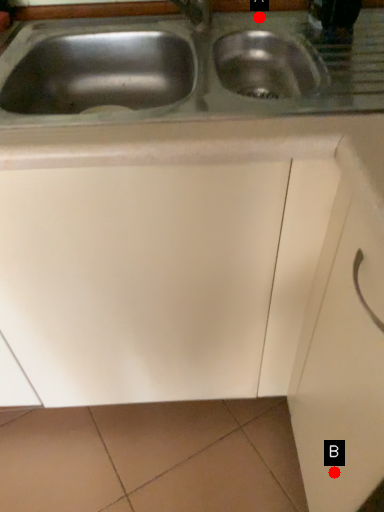
Question: Two points are circled on the image, labeled by A and B beside each circle. Which point is closer to the camera?

Choices:
 (A) A is closer
 (B) B is closer

Answer: (B)